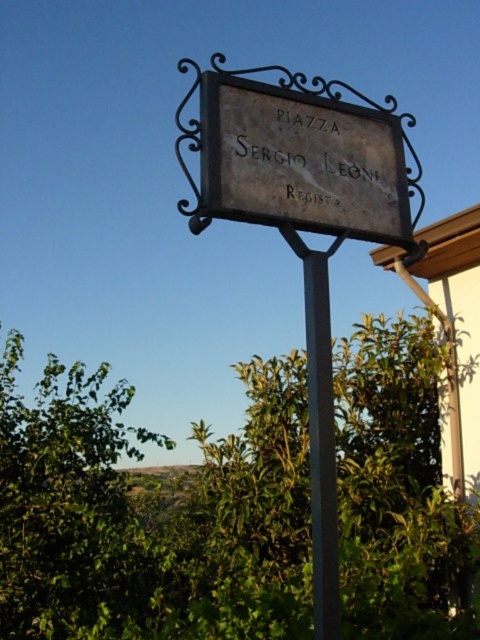
This screenshot has height=640, width=480. What do you see at coordinates (303, 224) in the screenshot? I see `dark gray metal sign at center` at bounding box center [303, 224].

Does dark gray metal sign at center have a lesser width compared to metallic pole at center?

Incorrect, dark gray metal sign at center's width is not less than metallic pole at center's.

Measure the distance between dark gray metal sign at center and camera.

The distance of dark gray metal sign at center from camera is 3.50 meters.

Locate an element on the screen. Image resolution: width=480 pixels, height=640 pixels. dark gray metal sign at center is located at coordinates (303, 224).

Which is below, dark gray stone sign at center or metallic pole at center?

Positioned lower is metallic pole at center.

Can you confirm if dark gray stone sign at center is positioned to the right of metallic pole at center?

In fact, dark gray stone sign at center is to the left of metallic pole at center.

This screenshot has height=640, width=480. I want to click on dark gray stone sign at center, so click(300, 161).

In order to click on dark gray stone sign at center in this screenshot , I will do `click(300, 161)`.

Between dark gray metal sign at center and dark gray stone sign at center, which one is positioned higher?

dark gray stone sign at center is higher up.

Can you confirm if dark gray metal sign at center is thinner than dark gray stone sign at center?

Incorrect, dark gray metal sign at center's width is not less than dark gray stone sign at center's.

Is point (325, 387) positioned behind point (322, 154)?

No, it is not.

At what (x,y) coordinates should I click in order to perform the action: click on dark gray metal sign at center. Please return your answer as a coordinate pair (x, y). Looking at the image, I should click on (303, 224).